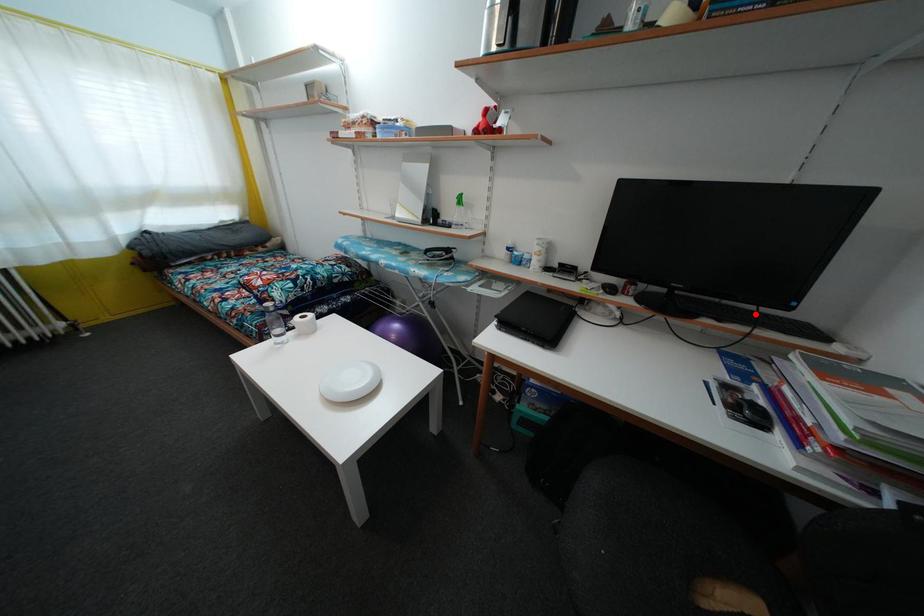
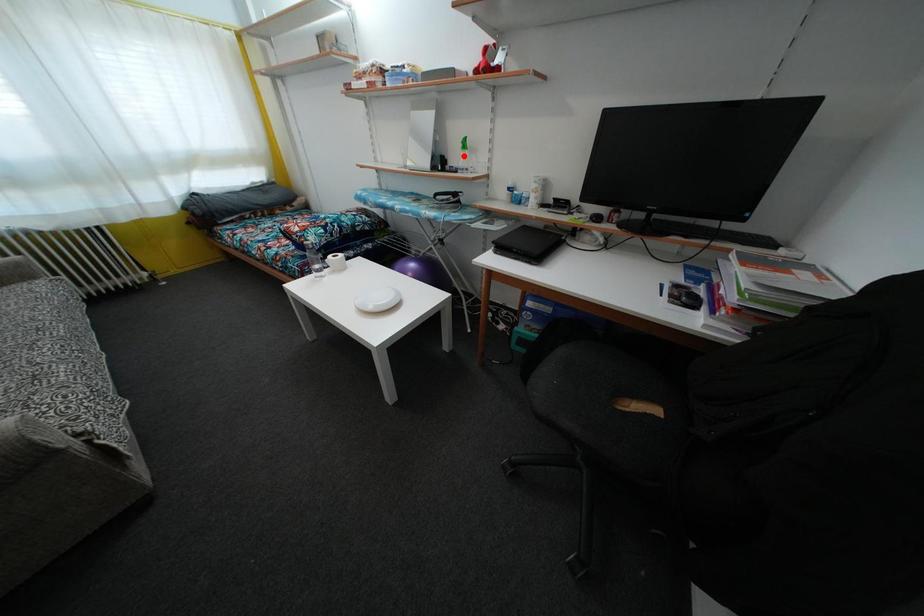
I am providing you with two images of the same scene from different viewpoints. A red point is marked on the first image and another point is marked on the second image. Are the points marked in image1 and image2 representing the same 3D position?

No